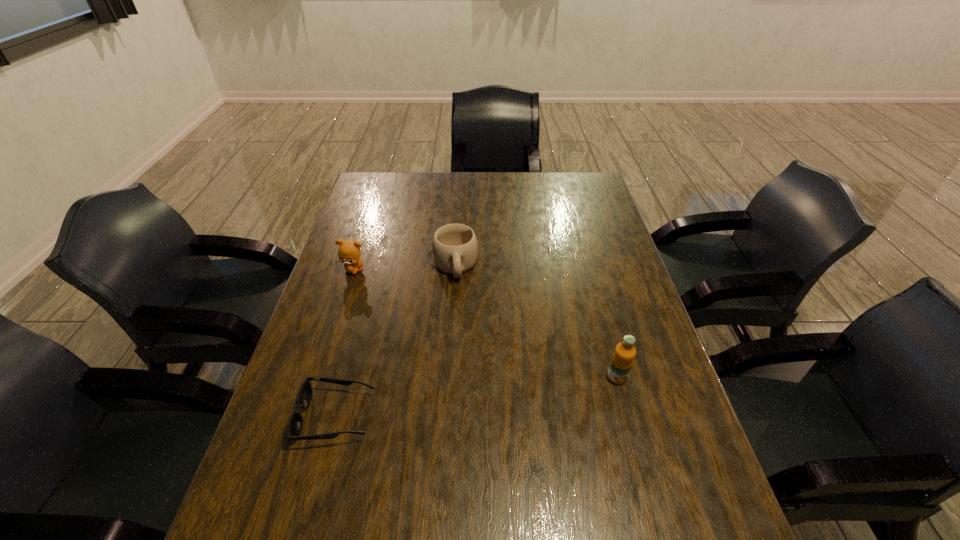
In order to click on vacant space located 0.290m on the face of the teddy bear in this screenshot , I will do `click(420, 328)`.

This screenshot has width=960, height=540. I want to click on free space located 0.240m on the face of the teddy bear, so click(x=409, y=318).

Identify the location of vacant space located 0.280m on the face of the teddy bear. point(418,326).

You are a GUI agent. You are given a task and a screenshot of the screen. Output one action in this format:
    pyautogui.click(x=<x>, y=<y>)
    Task: Click on the sunglasses that is at the left edge
    The width and height of the screenshot is (960, 540).
    Given the screenshot: What is the action you would take?
    pyautogui.click(x=304, y=398)

Find the location of a particular element. teddy bear present at the left edge is located at coordinates (349, 251).

Image resolution: width=960 pixels, height=540 pixels. Find the location of `object at the right edge`. object at the right edge is located at coordinates (622, 360).

In the image, there is a desktop. Find the location of `vacant space at the far edge`. vacant space at the far edge is located at coordinates (456, 177).

Where is `free location at the left edge`? free location at the left edge is located at coordinates (320, 403).

This screenshot has height=540, width=960. In the image, there is a desktop. What are the coordinates of `blank space at the right edge` in the screenshot? It's located at (621, 334).

Where is `vacant region at the far left corner of the desktop`? vacant region at the far left corner of the desktop is located at coordinates (372, 194).